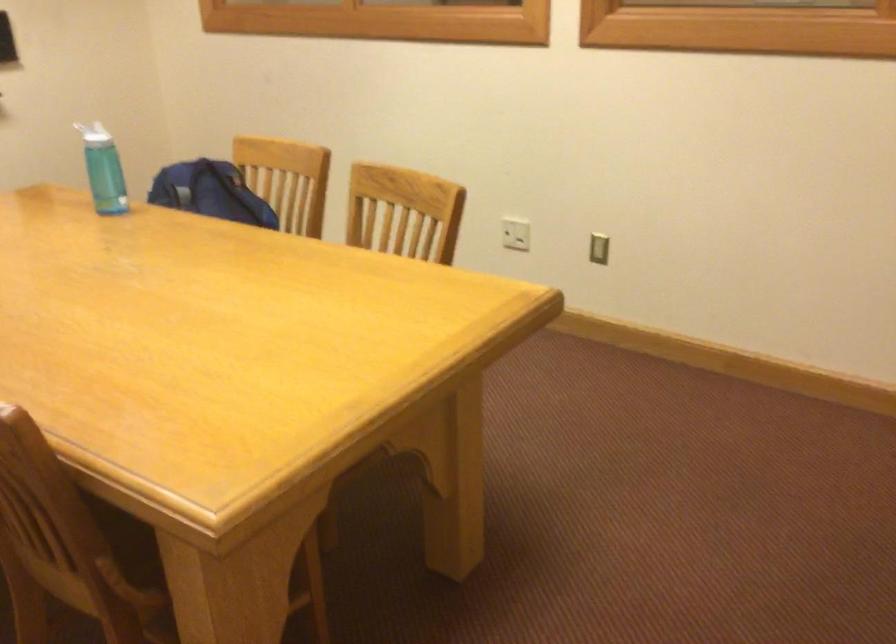
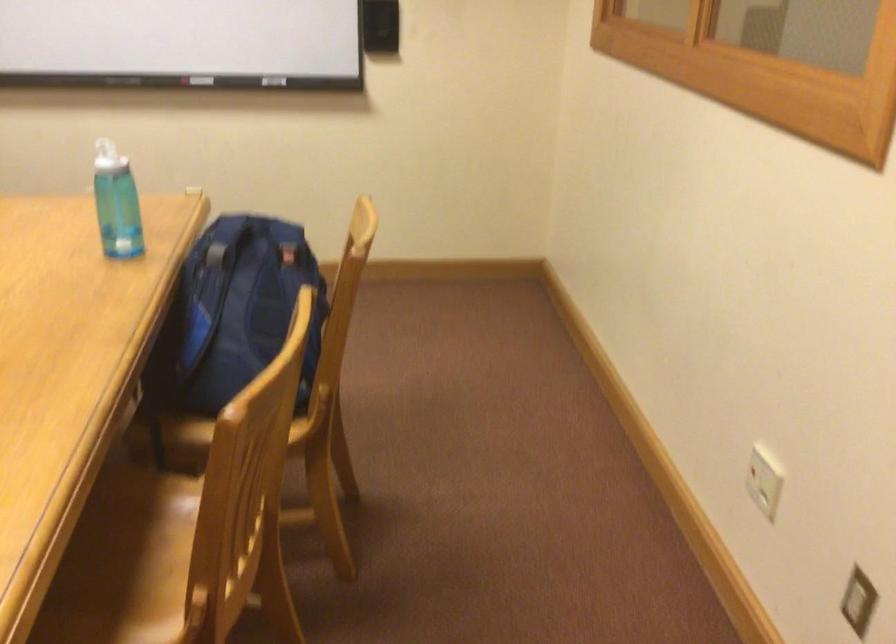
Find the pixel in the second image that matches (532,228) in the first image.

(764, 480)